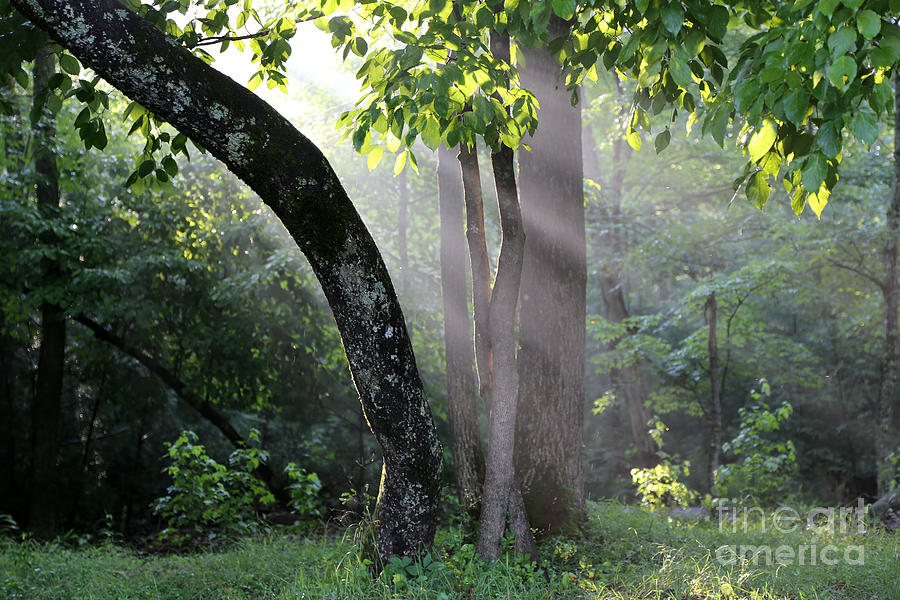
The height and width of the screenshot is (600, 900). I want to click on shade, so (57, 498).